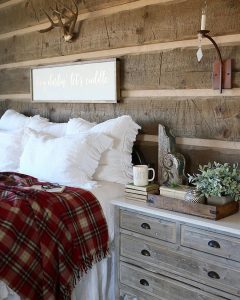
Find the location of a particular element. The width and height of the screenshot is (240, 300). bed is located at coordinates (102, 190).